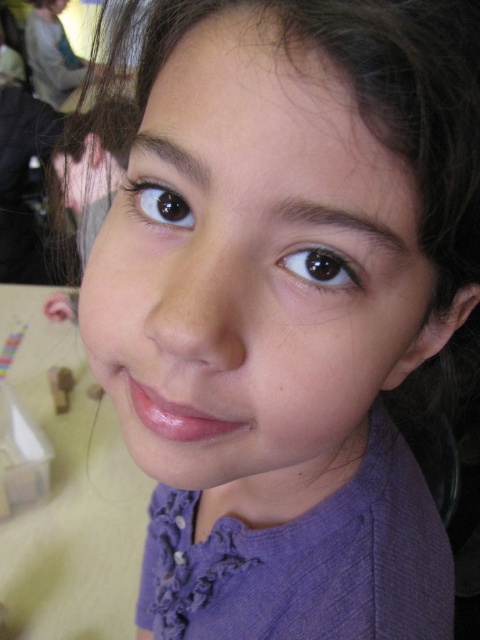
You are an artist trying to sketch the young girl in the image. To ensure accuracy, you need to know the position of her smooth skin face at center. Can you confirm if the coordinates provided are precise enough for a detailed portrait?

The smooth skin face at center is located at point (255, 269), so yes, the coordinates are precise enough for a detailed portrait as they provide exact positioning.

You are an artist sketching this girl. You want to draw the smooth skin face at center and the brown glossy eye at upper left. Which one should you draw first to make the drawing look correct?

You should draw the smooth skin face at center first because it is in front of the brown glossy eye at upper left, so it should be placed over the eye in the composition.

You are a photographer adjusting the focus on your camera. You want to ensure that both the smooth skin face at center and the brown glossy eye at upper center are in sharp focus. Given their positions, which object should you focus on first to achieve this?

The smooth skin face at center is closer to the viewer than the brown glossy eye at upper center. To ensure both are in focus, you should focus on the smooth skin face at center first, as focusing on the closer object allows the farther object to fall within the depth of field.